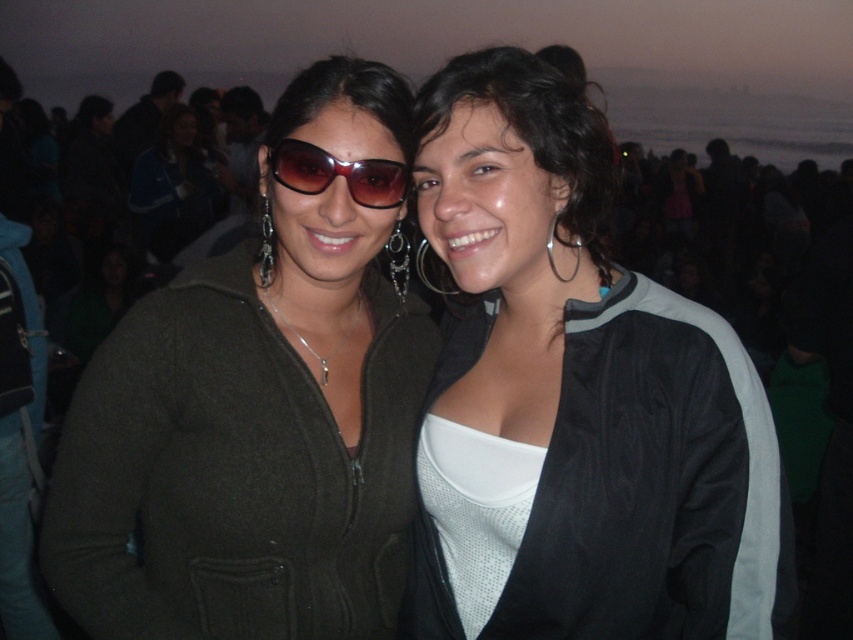
Does dark brown hair at center appear on the left side of sunglasses at center?

Incorrect, dark brown hair at center is not on the left side of sunglasses at center.

Is dark brown hair at center behind sunglasses at center?

No, it is in front of sunglasses at center.

Is point (506, 58) closer to camera compared to point (363, 189)?

Yes, point (506, 58) is closer to viewer.

Locate an element on the screen. The image size is (853, 640). dark brown hair at center is located at coordinates (535, 132).

Which is below, black fabric jacket at center or sunglasses at center?

black fabric jacket at center is below.

Is black fabric jacket at center positioned in front of sunglasses at center?

That is True.

The width and height of the screenshot is (853, 640). What do you see at coordinates (573, 396) in the screenshot? I see `black fabric jacket at center` at bounding box center [573, 396].

Where is `black fabric jacket at center`? black fabric jacket at center is located at coordinates (573, 396).

Who is positioned more to the left, matte black jacket at center or sunglasses at center?

matte black jacket at center is more to the left.

Is matte black jacket at center positioned before sunglasses at center?

Yes, it is in front of sunglasses at center.

Which is in front, point (183, 636) or point (360, 200)?

Point (183, 636) is more forward.

Locate an element on the screen. The height and width of the screenshot is (640, 853). matte black jacket at center is located at coordinates [256, 416].